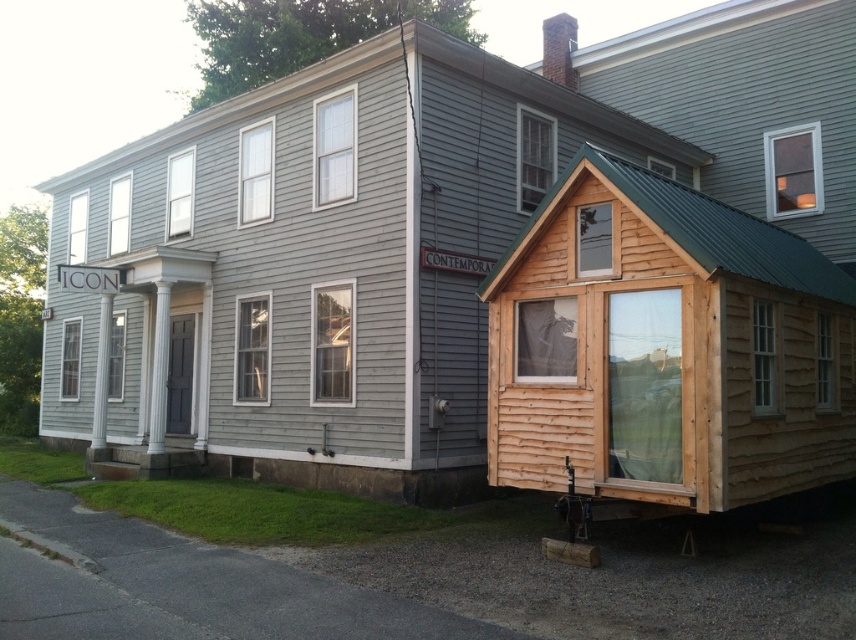
Question: Can you confirm if natural wood cabin at right is positioned to the right of wooden cabin at upper right?

Choices:
 (A) no
 (B) yes

Answer: (A)

Question: Which point is closer to the camera?

Choices:
 (A) natural wood cabin at right
 (B) wooden cabin at upper right

Answer: (A)

Question: Can you confirm if natural wood cabin at right is thinner than wooden cabin at upper right?

Choices:
 (A) yes
 (B) no

Answer: (B)

Question: Which of the following is the farthest from the observer?

Choices:
 (A) (852, 273)
 (B) (759, 70)

Answer: (B)

Question: Is natural wood cabin at right behind wooden cabin at upper right?

Choices:
 (A) yes
 (B) no

Answer: (B)